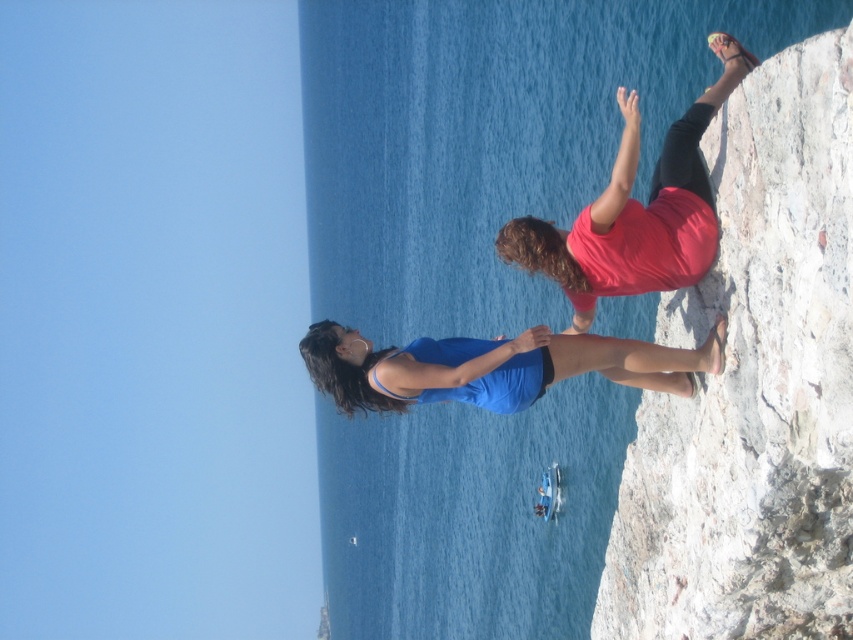
Question: Which is nearer to the smooth gray rock at right?

Choices:
 (A) matte red shirt at upper right
 (B) blue fabric at center

Answer: (B)

Question: Does smooth gray rock at right appear under blue fabric at center?

Choices:
 (A) no
 (B) yes

Answer: (B)

Question: Does matte red shirt at upper right appear over blue fabric at center?

Choices:
 (A) no
 (B) yes

Answer: (B)

Question: Which point is farther to the camera?

Choices:
 (A) click(x=769, y=253)
 (B) click(x=302, y=355)

Answer: (B)

Question: Which object is the farthest from the smooth gray rock at right?

Choices:
 (A) blue fabric at center
 (B) matte red shirt at upper right

Answer: (B)

Question: Does smooth gray rock at right lie in front of matte red shirt at upper right?

Choices:
 (A) no
 (B) yes

Answer: (B)